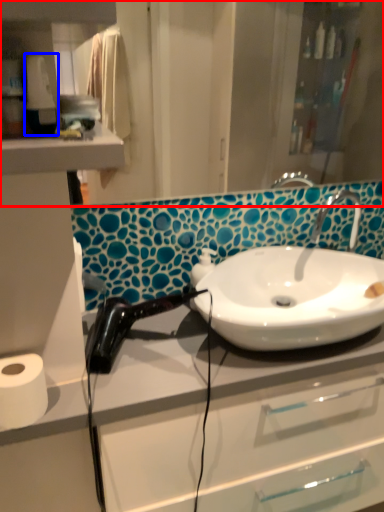
Question: Among these objects, which one is farthest to the camera, mirror (highlighted by a red box) or hand dryer (highlighted by a blue box)?

Choices:
 (A) mirror
 (B) hand dryer

Answer: (A)